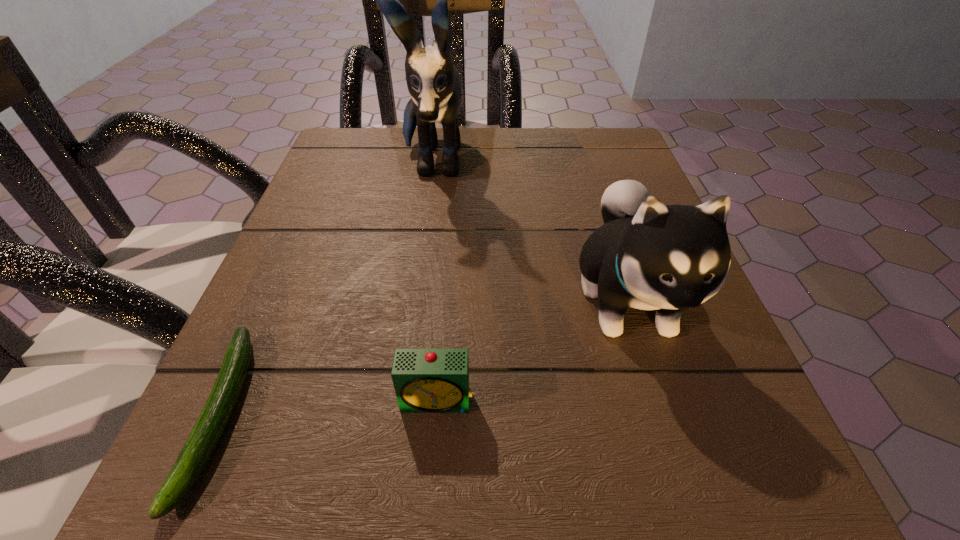
Where is `blank space at the far right corner of the desktop`? The image size is (960, 540). blank space at the far right corner of the desktop is located at coordinates (563, 159).

This screenshot has height=540, width=960. In the image, there is a desktop. Find the location of `vacant space at the near right corner`. vacant space at the near right corner is located at coordinates (684, 458).

Where is `vacant area that lies between the second shortest object and the taller puppy`? This screenshot has height=540, width=960. vacant area that lies between the second shortest object and the taller puppy is located at coordinates (435, 282).

Where is `blank region between the zucchini and the alarm clock`? The image size is (960, 540). blank region between the zucchini and the alarm clock is located at coordinates [x=329, y=408].

This screenshot has height=540, width=960. I want to click on free space between the third shortest object and the farthest object, so click(x=530, y=231).

Image resolution: width=960 pixels, height=540 pixels. What are the coordinates of `free space between the second shortest object and the third shortest object` in the screenshot? It's located at (533, 349).

Locate an element on the screen. The width and height of the screenshot is (960, 540). free space between the rightmost object and the tallest object is located at coordinates (530, 231).

At what (x,y) coordinates should I click in order to perform the action: click on blank region between the left puppy and the leftmost object. Please return your answer as a coordinate pair (x, y). The height and width of the screenshot is (540, 960). Looking at the image, I should click on (326, 289).

The width and height of the screenshot is (960, 540). Identify the location of free space that is in between the leftmost object and the third tallest object. (329, 408).

The height and width of the screenshot is (540, 960). In order to click on vacant region between the left puppy and the right puppy in this screenshot , I will do `click(530, 231)`.